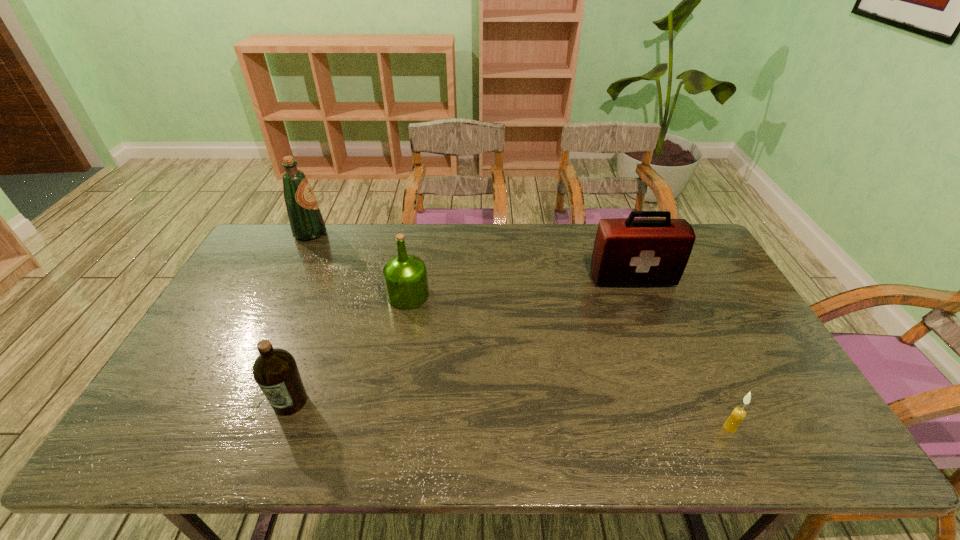
Where is `vacant space situated 0.380m on the side of the first aid kit with the cross symbol`? The height and width of the screenshot is (540, 960). vacant space situated 0.380m on the side of the first aid kit with the cross symbol is located at coordinates (677, 392).

This screenshot has height=540, width=960. What are the coordinates of `vacant space located 0.140m on the left of the rightmost olive oil` in the screenshot? It's located at (343, 295).

This screenshot has height=540, width=960. Identify the location of vacant point located on the label of the fourth object from right to left. click(276, 442).

Where is `blank space located 0.050m on the right of the nearest object`? blank space located 0.050m on the right of the nearest object is located at coordinates (756, 428).

Locate an element on the screen. The width and height of the screenshot is (960, 540). object positioned at the far edge is located at coordinates (306, 221).

The height and width of the screenshot is (540, 960). I want to click on object that is at the near edge, so click(x=738, y=414).

I want to click on object that is at the left edge, so click(306, 221).

The image size is (960, 540). I want to click on object that is at the right edge, so click(x=631, y=251).

The image size is (960, 540). Find the location of `object present at the far left corner`. object present at the far left corner is located at coordinates (306, 221).

Find the location of a particular element. This screenshot has height=540, width=960. vacant point at the far edge is located at coordinates (574, 252).